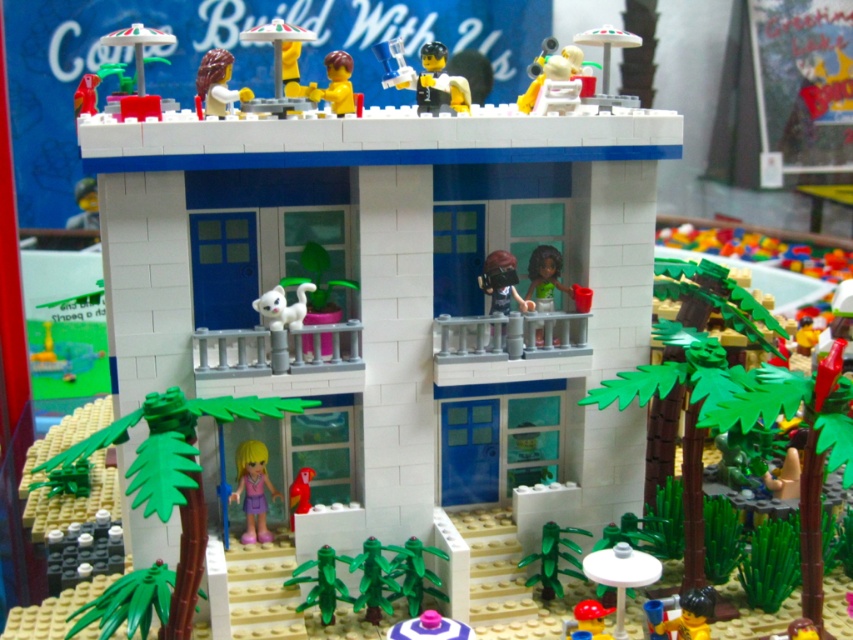
You are a visitor looking at the LEGO house. You notice the brown matte helmet at upper center and the smooth plastic minifigure at lower right. Which object would you say is taller?

The brown matte helmet at upper center is much taller than the smooth plastic minifigure at lower right.

You are a visitor approaching the LEGO house and want to greet both the metallic silver minifigure at upper center and the smooth yellow minifigure at center. Which minifigure will you see first as you approach the house?

You will see the metallic silver minifigure at upper center first because it is closer to you than the smooth yellow minifigure at center.

You are a LEGO minifigure standing at point [310,595] and want to move to the rooftop lounge area. There is another point at [376,589] in your path. Can you reach the rooftop lounge without passing through the other point?

Point [376,589] is behind point [310,595], so you can reach the rooftop lounge without passing through the other point as it is already behind your current position.